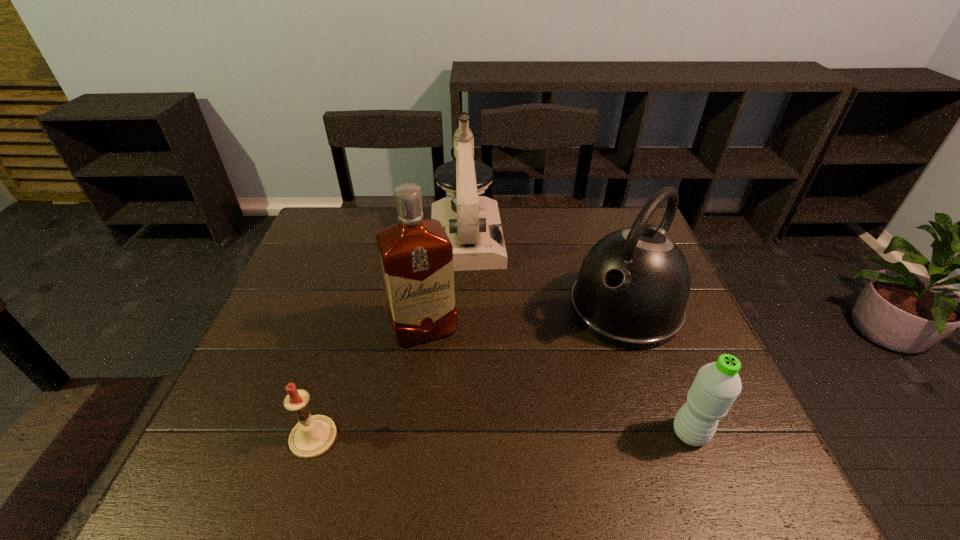
Locate an element on the screen. the leftmost object is located at coordinates (313, 435).

You are a GUI agent. You are given a task and a screenshot of the screen. Output one action in this format:
    pyautogui.click(x=<x>, y=<y>)
    Task: Click on the candle
    The height and width of the screenshot is (540, 960).
    Given the screenshot: What is the action you would take?
    pyautogui.click(x=313, y=435)

This screenshot has height=540, width=960. I want to click on water bottle, so click(x=716, y=386).

Where is `liquor`? The width and height of the screenshot is (960, 540). liquor is located at coordinates (416, 255).

Find the location of a particular element. The height and width of the screenshot is (540, 960). the farthest object is located at coordinates (472, 223).

Where is `the third tallest object`? This screenshot has height=540, width=960. the third tallest object is located at coordinates (633, 286).

The image size is (960, 540). In order to click on vacant space located on the right of the candle in this screenshot , I will do `click(501, 437)`.

Identify the location of free space located on the left of the second shortest object. (586, 433).

This screenshot has width=960, height=540. I want to click on vacant space located on the front label of the liquor, so click(x=455, y=413).

Identify the location of vacant region located 0.080m on the front label of the liquor. This screenshot has width=960, height=540. (443, 377).